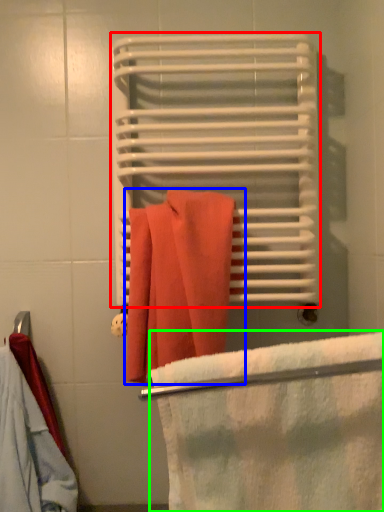
Question: Considering the real-world distances, which object is closest to bath towel (highlighted by a red box)? towel (highlighted by a blue box) or beach towel (highlighted by a green box).

Choices:
 (A) towel
 (B) beach towel

Answer: (A)